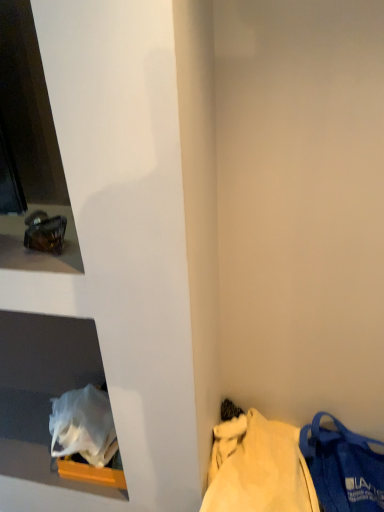
Question: From the image's perspective, is white plastic bag at lower left on top of blue fabric tote bag at lower right?

Choices:
 (A) no
 (B) yes

Answer: (B)

Question: Does white plastic bag at lower left appear on the left side of blue fabric tote bag at lower right?

Choices:
 (A) yes
 (B) no

Answer: (A)

Question: Can you confirm if white plastic bag at lower left is bigger than blue fabric tote bag at lower right?

Choices:
 (A) no
 (B) yes

Answer: (A)

Question: Is white plastic bag at lower left shorter than blue fabric tote bag at lower right?

Choices:
 (A) yes
 (B) no

Answer: (A)

Question: Is the depth of white plastic bag at lower left less than that of blue fabric tote bag at lower right?

Choices:
 (A) no
 (B) yes

Answer: (A)

Question: Is white plastic bag at lower left further to the viewer compared to blue fabric tote bag at lower right?

Choices:
 (A) yes
 (B) no

Answer: (A)

Question: Is matte glass ashtray at upper left directly adjacent to white plastic bag at lower left?

Choices:
 (A) yes
 (B) no

Answer: (B)

Question: Can we say matte glass ashtray at upper left lies outside white plastic bag at lower left?

Choices:
 (A) no
 (B) yes

Answer: (B)

Question: From a real-world perspective, is matte glass ashtray at upper left located beneath white plastic bag at lower left?

Choices:
 (A) yes
 (B) no

Answer: (B)

Question: From a real-world perspective, is matte glass ashtray at upper left physically above white plastic bag at lower left?

Choices:
 (A) yes
 (B) no

Answer: (A)

Question: Can you confirm if matte glass ashtray at upper left is shorter than white plastic bag at lower left?

Choices:
 (A) no
 (B) yes

Answer: (A)

Question: Does matte glass ashtray at upper left have a smaller size compared to white plastic bag at lower left?

Choices:
 (A) yes
 (B) no

Answer: (A)

Question: Is matte blue fabric bag at lower right outside of matte glass ashtray at upper left?

Choices:
 (A) no
 (B) yes

Answer: (B)